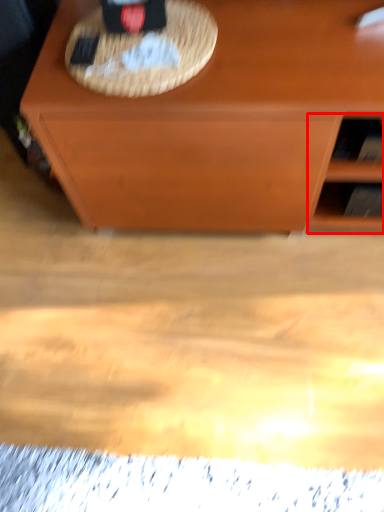
Question: Where is shelf (annotated by the red box) located in relation to picnic basket in the image?

Choices:
 (A) right
 (B) left

Answer: (A)